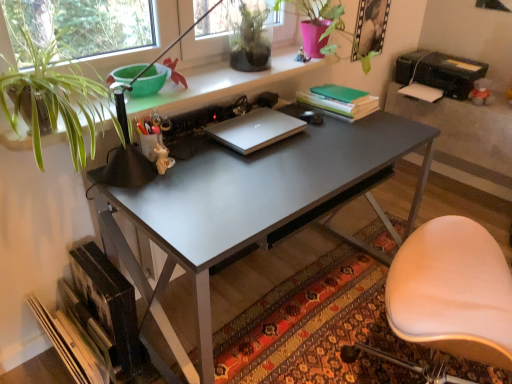
Question: Is green matte plant at upper center, which appears as the second houseplant when viewed from the left, facing towards green leafy plant at upper left, the first houseplant positioned from the bottom?

Choices:
 (A) no
 (B) yes

Answer: (A)

Question: Considering the relative positions of green matte plant at upper center, which appears as the second houseplant when viewed from the left, and green leafy plant at upper left, which appears as the 2th houseplant when viewed from the top, in the image provided, is green matte plant at upper center, which appears as the second houseplant when viewed from the left, to the left of green leafy plant at upper left, which appears as the 2th houseplant when viewed from the top, from the viewer's perspective?

Choices:
 (A) no
 (B) yes

Answer: (A)

Question: Is green matte plant at upper center, which appears as the 2th houseplant when ordered from the bottom, not within green leafy plant at upper left, the first houseplant positioned from the bottom?

Choices:
 (A) no
 (B) yes

Answer: (B)

Question: Does green matte plant at upper center, which is the second houseplant from front to back, have a lesser height compared to green leafy plant at upper left, the 2th houseplant viewed from the right?

Choices:
 (A) yes
 (B) no

Answer: (A)

Question: From a real-world perspective, is green matte plant at upper center, which is the first houseplant in back-to-front order, positioned under green leafy plant at upper left, the first houseplant positioned from the bottom, based on gravity?

Choices:
 (A) no
 (B) yes

Answer: (A)

Question: Does green matte plant at upper center, which appears as the second houseplant when viewed from the left, appear on the right side of green leafy plant at upper left, which is the second houseplant in back-to-front order?

Choices:
 (A) no
 (B) yes

Answer: (B)

Question: Is black plastic printer at upper right facing towards silver metallic laptop at center?

Choices:
 (A) yes
 (B) no

Answer: (A)

Question: From the image's perspective, is black plastic printer at upper right located beneath silver metallic laptop at center?

Choices:
 (A) no
 (B) yes

Answer: (A)

Question: Is black plastic printer at upper right bigger than silver metallic laptop at center?

Choices:
 (A) no
 (B) yes

Answer: (B)

Question: Considering the relative sizes of black plastic printer at upper right and silver metallic laptop at center in the image provided, is black plastic printer at upper right smaller than silver metallic laptop at center?

Choices:
 (A) yes
 (B) no

Answer: (B)

Question: Is black plastic printer at upper right outside silver metallic laptop at center?

Choices:
 (A) no
 (B) yes

Answer: (B)

Question: From the image's perspective, is black plastic printer at upper right over silver metallic laptop at center?

Choices:
 (A) no
 (B) yes

Answer: (B)

Question: Can you confirm if green matte plant at upper center, which is the 1th houseplant from right to left, is wider than silver metallic laptop at center?

Choices:
 (A) yes
 (B) no

Answer: (B)